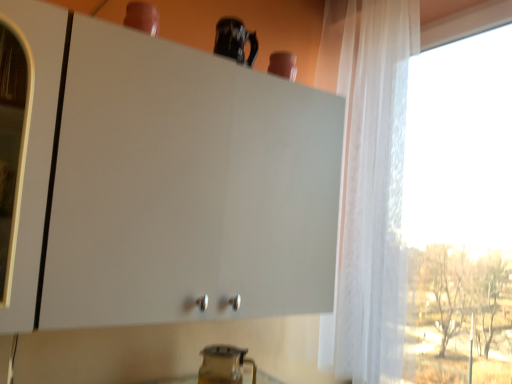
Question: Considering the positions of transparent glass pitcher at lower center, the 2th appliance in the top-to-bottom sequence, and white matte cabinet at upper center in the image, is transparent glass pitcher at lower center, the 2th appliance in the top-to-bottom sequence, wider or thinner than white matte cabinet at upper center?

Choices:
 (A) wide
 (B) thin

Answer: (B)

Question: From the image's perspective, is transparent glass pitcher at lower center, the first appliance in the bottom-to-top sequence, located above or below white matte cabinet at upper center?

Choices:
 (A) below
 (B) above

Answer: (A)

Question: Which is nearer to the glossy ceramic mug at upper center, positioned as the 2th appliance in bottom-to-top order?

Choices:
 (A) white matte cabinet at upper center
 (B) transparent curtain at right
 (C) transparent glass pitcher at lower center, the first appliance in the bottom-to-top sequence

Answer: (A)

Question: Which of these objects is positioned closest to the white matte cabinet at upper center?

Choices:
 (A) glossy ceramic mug at upper center, positioned as the 2th appliance in bottom-to-top order
 (B) transparent curtain at right
 (C) transparent glass pitcher at lower center, which appears as the 1th appliance when viewed from the back

Answer: (A)